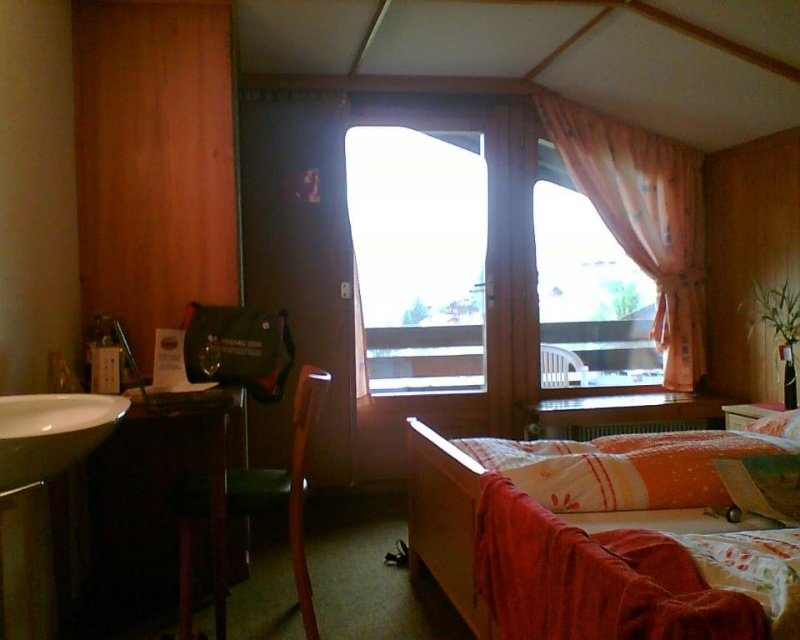
You are standing at the point marked by the coordinates (285, 486) in the room. Looking around, you see the bed with a wooden frame and the small wooden desk. Which object is closer to your current position?

The point marked by the coordinates (285, 486) indicates the location of the green fabric chair at lower left. Since this chair is closer to the bed with a wooden frame than the small wooden desk, the bed with a wooden frame is closer to your current position.

You are standing in the room and want to place a small plant between the two points marked as point (240,506) and point (84,445). Since you want the plant to be closer to the window, which point should you place it near?

The point (84,445) is closer to the window, so placing the plant near that point would make it closer to the window.

From the picture: You are standing in the room and want to locate the pink fabric curtain at upper right. According to the coordinates provided, where should you look?

The pink fabric curtain at upper right is located at point (644, 218).